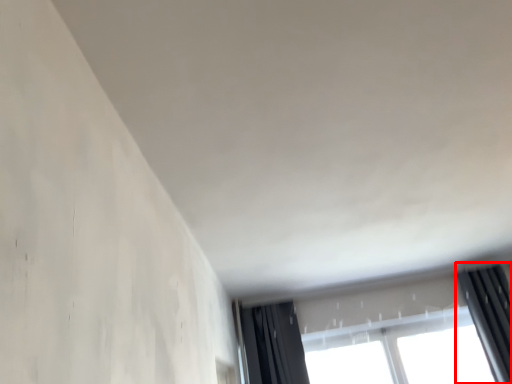
Question: From the image's perspective, what is the correct spatial relationship of curtain (annotated by the red box) in relation to window?

Choices:
 (A) below
 (B) above

Answer: (A)